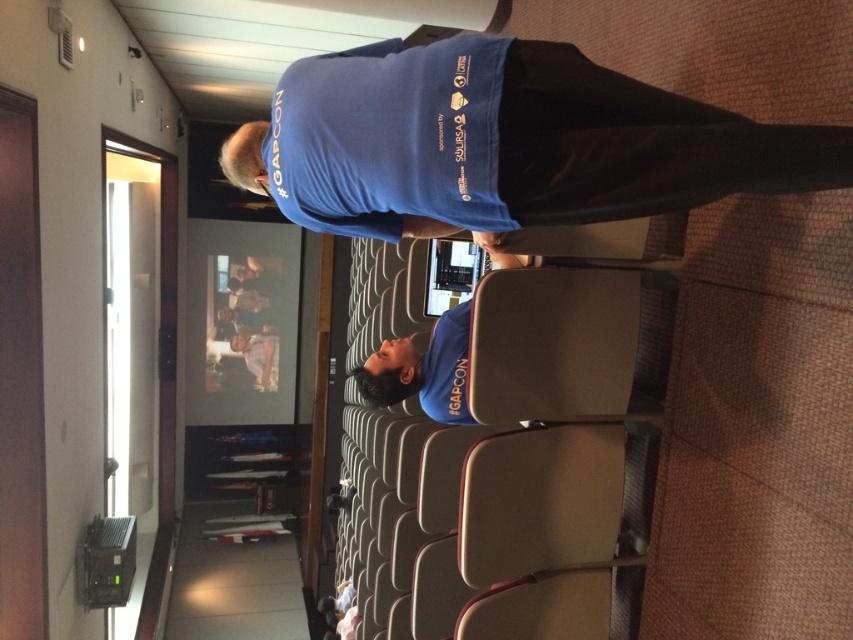
You are standing at the point labeled point (334, 76). You want to walk to the point labeled point (397, 397). Which direction should you face to walk directly towards your destination?

Since point (334, 76) is in front of point (397, 397), you should face backward to walk directly towards point (397, 397).